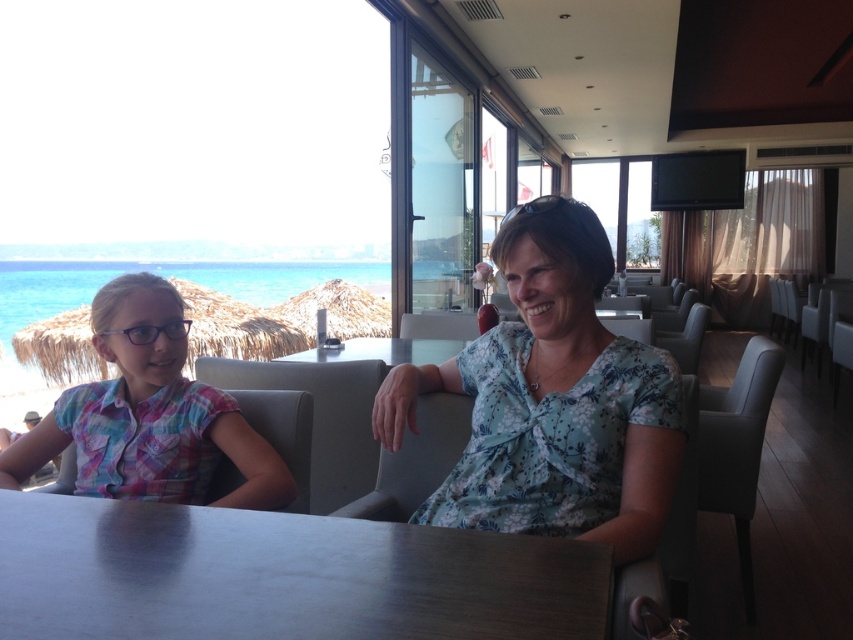
What is located at the coordinates point (552, 403) in the image?

The point (552, 403) marks the floral fabric blouse at center.

You are a photographer setting up a shoot in this restaurant. You need to decide which of the two subjects, the floral fabric blouse at center or the multicolored plaid shirt at left, would require a wider lens to capture the entire garment in the frame. Based on their sizes, which one should you choose?

The multicolored plaid shirt at left has a larger width than the floral fabric blouse at center, so you should choose the multicolored plaid shirt at left to require a wider lens for capturing the entire garment in the frame.

You are a guest at the restaurant and want to place your black plastic goggles at upper center on the table. Can you put them on the smooth glass table at center without moving anything else?

→ The smooth glass table at center is positioned on the left side of black plastic goggles at upper center, so the goggles are already placed on the table. Therefore, you don not need to move anything else.